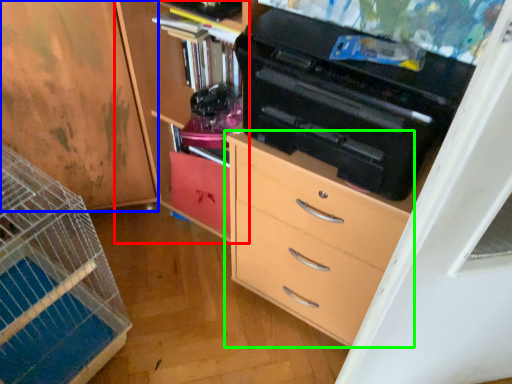
Question: Which object is the closest to the cabinetry (highlighted by a red box)? Choose among these: cabinetry (highlighted by a blue box) or chest of drawers (highlighted by a green box).

Choices:
 (A) cabinetry
 (B) chest of drawers

Answer: (A)